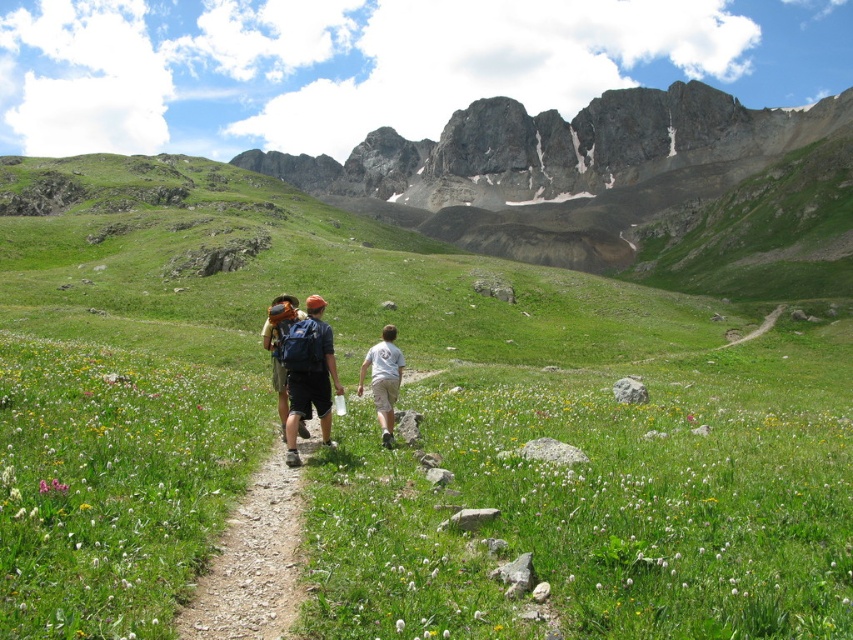
Based on the photo, who is higher up, dirt/gravel path at center or matte blue backpack at center?

Positioned higher is matte blue backpack at center.

Who is positioned more to the left, dirt/gravel path at center or matte blue backpack at center?

matte blue backpack at center is more to the left.

Who is more forward, (228, 516) or (294, 461)?

Point (228, 516)

Locate an element on the screen. The height and width of the screenshot is (640, 853). dirt/gravel path at center is located at coordinates (252, 563).

Can you confirm if white cotton shirt at center is positioned below matte brown backpack at center?

Correct, white cotton shirt at center is located below matte brown backpack at center.

Is white cotton shirt at center to the right of matte brown backpack at center from the viewer's perspective?

Correct, you'll find white cotton shirt at center to the right of matte brown backpack at center.

Is point (381, 376) farther from viewer compared to point (283, 397)?

Yes.

This screenshot has width=853, height=640. In order to click on white cotton shirt at center in this screenshot , I will do `click(383, 380)`.

Between dirt/gravel path at center and white cotton shirt at center, which one appears on the right side from the viewer's perspective?

white cotton shirt at center is more to the right.

Is dirt/gravel path at center to the left of white cotton shirt at center from the viewer's perspective?

Indeed, dirt/gravel path at center is positioned on the left side of white cotton shirt at center.

Describe the element at coordinates (252, 563) in the screenshot. I see `dirt/gravel path at center` at that location.

Where is `dirt/gravel path at center`? Image resolution: width=853 pixels, height=640 pixels. dirt/gravel path at center is located at coordinates (252, 563).